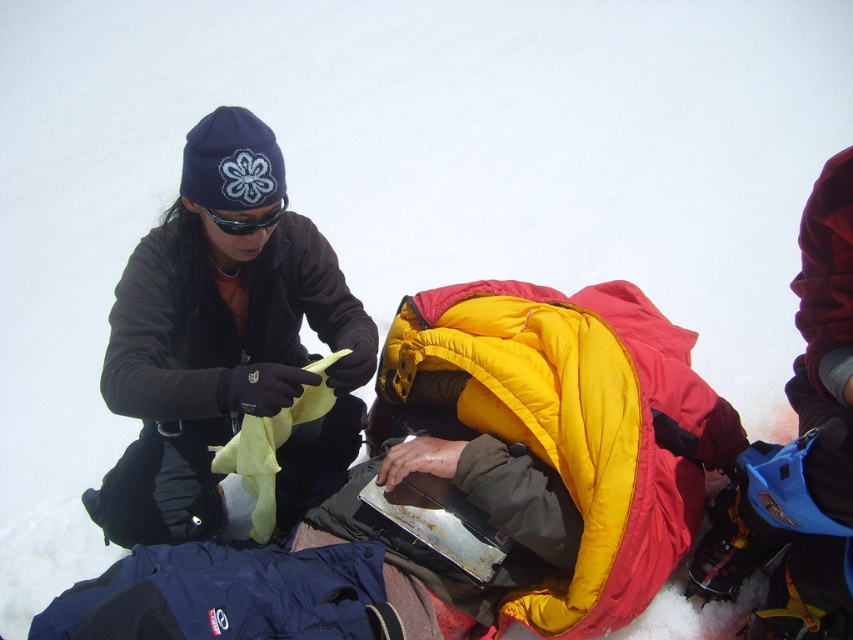
Question: Is matte black jacket at left to the left of matte black goggles at upper center from the viewer's perspective?

Choices:
 (A) yes
 (B) no

Answer: (A)

Question: Can you confirm if matte black jacket at left is positioned to the right of matte black goggles at upper center?

Choices:
 (A) yes
 (B) no

Answer: (B)

Question: Which point appears farthest from the camera in this image?

Choices:
 (A) (224, 220)
 (B) (126, 378)

Answer: (A)

Question: Which point is farther from the camera taking this photo?

Choices:
 (A) coord(235,230)
 (B) coord(154,300)

Answer: (B)

Question: Is matte black jacket at left above matte black goggles at upper center?

Choices:
 (A) yes
 (B) no

Answer: (B)